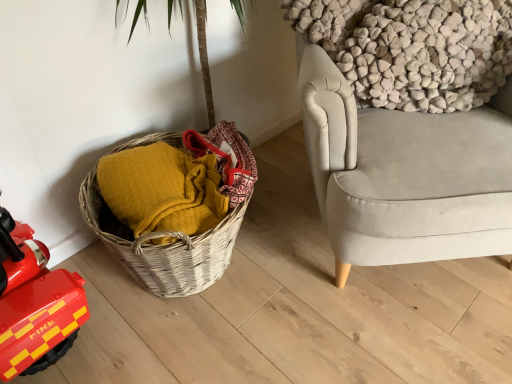
Locate an element on the screen. This screenshot has height=384, width=512. spots to the right of red plastic toy at lower left is located at coordinates (118, 339).